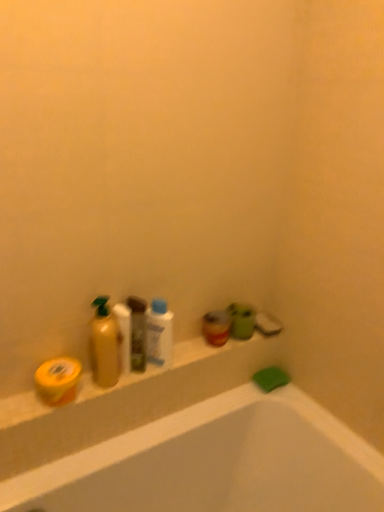
From the picture: In order to face shiny gold bottle at left, should I rotate leftwards or rightwards?

Turn left approximately 11.861 degrees to face it.

Measure the distance between point (61, 392) and camera.

They are 3.37 feet apart.

In order to face green plastic bottle at center, which appears as the 1th toiletry when viewed from the left, should I rotate leftwards or rightwards?

You should look left and rotate roughly 7.705 degrees.

Image resolution: width=384 pixels, height=512 pixels. I want to click on green matte soap at lower right, arranged as the second soap when viewed from the front, so click(271, 378).

Identify the location of the 2nd soap below when counting from the green plastic bottle at center, which appears as the 1th toiletry when viewed from the left (from the image's perspective). The image size is (384, 512). (271, 378).

Considering the relative sizes of green plastic bottle at center, marked as the 2th toiletry in a back-to-front arrangement, and green matte soap at lower right, arranged as the second soap when viewed from the front, in the image provided, is green plastic bottle at center, marked as the 2th toiletry in a back-to-front arrangement, smaller than green matte soap at lower right, arranged as the second soap when viewed from the front,?

No.

From a real-world perspective, does green plastic bottle at center, marked as the 2th toiletry in a back-to-front arrangement, stand above green matte soap at lower right, arranged as the second soap when viewed from the front?

Yes, from a real-world perspective, green plastic bottle at center, marked as the 2th toiletry in a back-to-front arrangement, is over green matte soap at lower right, arranged as the second soap when viewed from the front

Can you see matte green cup at upper right, which is counted as the first toiletry, starting from the back, touching green matte soap at lower right, the 1th soap positioned from the right?

No, matte green cup at upper right, which is counted as the first toiletry, starting from the back, is not beside green matte soap at lower right, the 1th soap positioned from the right.

From a real-world perspective, who is located higher, matte green cup at upper right, the 1th toiletry viewed from the right, or green matte soap at lower right, the 1th soap positioned from the right?

From a 3D spatial view, matte green cup at upper right, the 1th toiletry viewed from the right, is above.

Who is bigger, matte green cup at upper right, the second toiletry in the front-to-back sequence, or green matte soap at lower right, which appears as the 1th soap when viewed from the back?

With larger size is matte green cup at upper right, the second toiletry in the front-to-back sequence.

Considering the relative positions of matte green cup at upper right, the second toiletry in the front-to-back sequence, and green matte soap at lower right, the 1th soap positioned from the right, in the image provided, is matte green cup at upper right, the second toiletry in the front-to-back sequence, to the left of green matte soap at lower right, the 1th soap positioned from the right, from the viewer's perspective?

Correct, you'll find matte green cup at upper right, the second toiletry in the front-to-back sequence, to the left of green matte soap at lower right, the 1th soap positioned from the right.

Between white glossy mouthwash at center, the 1th mouthwash viewed from the left, and yellow matte container at lower left, which one has less height?

Standing shorter between the two is yellow matte container at lower left.

From a real-world perspective, between white glossy mouthwash at center, the 1th mouthwash viewed from the left, and yellow matte container at lower left, who is vertically lower?

yellow matte container at lower left.

Between white glossy mouthwash at center, which is the 2th mouthwash from back to front, and yellow matte container at lower left, which one is positioned behind?

white glossy mouthwash at center, which is the 2th mouthwash from back to front, is further away from the camera.

Is point (153, 359) positioned in front of point (22, 403)?

No, (153, 359) is behind (22, 403).

Between green matte soap at lower right, the second soap positioned from the top, and yellow matte container at lower left, which one has smaller width?

green matte soap at lower right, the second soap positioned from the top.

From a real-world perspective, is green matte soap at lower right, the second soap positioned from the top, under yellow matte container at lower left?

Yes.

Between green matte soap at lower right, arranged as the second soap when viewed from the left, and yellow matte container at lower left, which one appears on the right side from the viewer's perspective?

green matte soap at lower right, arranged as the second soap when viewed from the left.

Consider the image. Is green matte soap at lower right, the second soap positioned from the top, situated inside yellow matte container at lower left or outside?

The correct answer is: outside.

Considering the relative positions of shiny gold bottle at left and green matte soap at lower right, arranged as the second soap when viewed from the front, in the image provided, is shiny gold bottle at left in front of green matte soap at lower right, arranged as the second soap when viewed from the front,?

Yes, shiny gold bottle at left is closer to the camera.

From the image's perspective, is shiny gold bottle at left located above green matte soap at lower right, marked as the 1th soap in a bottom-to-top arrangement?

Yes, from the image's perspective, shiny gold bottle at left is on top of green matte soap at lower right, marked as the 1th soap in a bottom-to-top arrangement.

Is shiny gold bottle at left inside the boundaries of green matte soap at lower right, the second soap positioned from the top, or outside?

shiny gold bottle at left exists outside the volume of green matte soap at lower right, the second soap positioned from the top.

Measure the distance from shiny gold bottle at left to green matte soap at lower right, the 1th soap positioned from the right.

shiny gold bottle at left and green matte soap at lower right, the 1th soap positioned from the right, are 21.29 inches apart.

Who is bigger, white glossy mouthwash at center, arranged as the 2th mouthwash when viewed from the right, or green plastic bottle at center, which is the 1th toiletry in front-to-back order?

white glossy mouthwash at center, arranged as the 2th mouthwash when viewed from the right.

Is white glossy mouthwash at center, the 1th mouthwash viewed from the left, oriented away from green plastic bottle at center, which is the 1th toiletry in front-to-back order?

white glossy mouthwash at center, the 1th mouthwash viewed from the left, is not turned away from green plastic bottle at center, which is the 1th toiletry in front-to-back order.

Which is more distant, [159,319] or [145,362]?

The point [145,362] is farther from the camera.

From the image's perspective, which is above, white glossy mouthwash at center, which is the 2th mouthwash from back to front, or green matte soap at lower right, the 1th soap positioned from the right?

white glossy mouthwash at center, which is the 2th mouthwash from back to front, appears higher in the image.

In the scene shown: Could you tell me if white glossy mouthwash at center, positioned as the 1th mouthwash in front-to-back order, is turned towards green matte soap at lower right, the 1th soap positioned from the right?

No, white glossy mouthwash at center, positioned as the 1th mouthwash in front-to-back order, does not turn towards green matte soap at lower right, the 1th soap positioned from the right.

Looking at this image, is white glossy mouthwash at center, the 1th mouthwash viewed from the left, not near green matte soap at lower right, the 1th soap positioned from the right?

No, there isn't a large distance between white glossy mouthwash at center, the 1th mouthwash viewed from the left, and green matte soap at lower right, the 1th soap positioned from the right.

From a real-world perspective, starting from the green plastic bottle at center, which is the second toiletry in right-to-left order, which soap is the 2nd one below it? Please provide its 2D coordinates.

[(271, 378)]

Starting from the green matte soap at lower right, the 1th soap positioned from the right, which toiletry is the 1st one in front? Please provide its 2D coordinates.

[(241, 321)]

From the image, which object appears to be farther from yellow matte bar of soap at left, arranged as the first soap when viewed from the left, green matte soap at lower right, arranged as the second soap when viewed from the left, or shiny gold bottle at left?

green matte soap at lower right, arranged as the second soap when viewed from the left, is positioned further to the anchor yellow matte bar of soap at left, arranged as the first soap when viewed from the left.

In the scene shown: Looking at the image, which one is located closer to shiny gold bottle at left, translucent plastic mouthwash at center, placed as the 1th mouthwash when sorted from back to front, or matte green cup at upper right, which is the second toiletry in left-to-right order?

The object closer to shiny gold bottle at left is translucent plastic mouthwash at center, placed as the 1th mouthwash when sorted from back to front.

Looking at the image, which one is located closer to white glossy mouthwash at center, positioned as the 1th mouthwash in front-to-back order, yellow matte bar of soap at left, which is the second soap from right to left, or green plastic bottle at center, which is the second toiletry in right-to-left order?

green plastic bottle at center, which is the second toiletry in right-to-left order, is positioned closer to the anchor white glossy mouthwash at center, positioned as the 1th mouthwash in front-to-back order.

Estimate the real-world distances between objects in this image. Which object is further from translucent plastic mouthwash at center, marked as the first mouthwash in a right-to-left arrangement, yellow matte bar of soap at left, positioned as the 1th soap in front-to-back order, or yellow matte container at lower left?

Based on the image, yellow matte bar of soap at left, positioned as the 1th soap in front-to-back order, appears to be further to translucent plastic mouthwash at center, marked as the first mouthwash in a right-to-left arrangement.

Considering their positions, is translucent plastic mouthwash at center, which is the 2th mouthwash in left-to-right order, positioned closer to green matte soap at lower right, marked as the 1th soap in a bottom-to-top arrangement, than white glossy mouthwash at center, the 1th mouthwash viewed from the left?

Among the two, translucent plastic mouthwash at center, which is the 2th mouthwash in left-to-right order, is located nearer to green matte soap at lower right, marked as the 1th soap in a bottom-to-top arrangement.

Looking at the image, which one is located further to yellow matte bar of soap at left, which is the second soap from right to left, translucent plastic mouthwash at center, placed as the 1th mouthwash when sorted from back to front, or white glossy mouthwash at center, positioned as the 1th mouthwash in front-to-back order?

Among the two, translucent plastic mouthwash at center, placed as the 1th mouthwash when sorted from back to front, is located further to yellow matte bar of soap at left, which is the second soap from right to left.

When comparing their distances from green matte soap at lower right, arranged as the second soap when viewed from the left, does white glossy mouthwash at center, positioned as the 1th mouthwash in front-to-back order, or yellow matte container at lower left seem closer?

Among the two, yellow matte container at lower left is located nearer to green matte soap at lower right, arranged as the second soap when viewed from the left.

From the image, which object appears to be nearer to green matte soap at lower right, arranged as the second soap when viewed from the front, yellow matte container at lower left or white glossy mouthwash at center, positioned as the 1th mouthwash in front-to-back order?

yellow matte container at lower left.

The image size is (384, 512). I want to click on mouthwash located between yellow matte container at lower left and translucent plastic mouthwash at center, placed as the second mouthwash when sorted from front to back, in the depth direction, so click(159, 334).

Locate an element on the screen. The width and height of the screenshot is (384, 512). toiletry between shiny gold bottle at left and translucent plastic mouthwash at center, which is the 2th mouthwash in left-to-right order, from left to right is located at coordinates (137, 333).

Find the location of a particular element. balustrade situated between green plastic bottle at center, which appears as the 1th toiletry when viewed from the left, and green matte soap at lower right, arranged as the second soap when viewed from the front, from left to right is located at coordinates tap(191, 369).

Where is `balustrade situated between yellow matte bar of soap at left, the 2th soap from the back, and translucent plastic mouthwash at center, marked as the first mouthwash in a right-to-left arrangement, from left to right`? Image resolution: width=384 pixels, height=512 pixels. balustrade situated between yellow matte bar of soap at left, the 2th soap from the back, and translucent plastic mouthwash at center, marked as the first mouthwash in a right-to-left arrangement, from left to right is located at coordinates (191, 369).